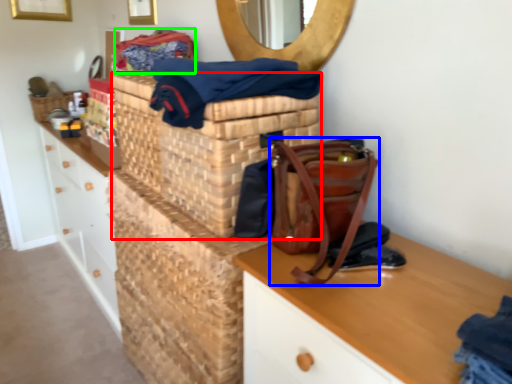
Question: Based on their relative distances, which object is farther from basket container (highlighted by a red box)? Choose from handbag (highlighted by a blue box) and material (highlighted by a green box).

Choices:
 (A) handbag
 (B) material

Answer: (B)